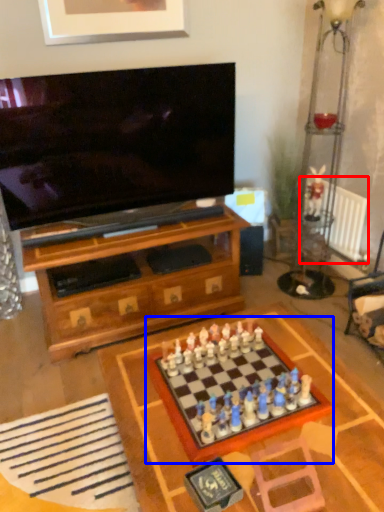
Question: Which point is further to the camera, radiator (highlighted by a red box) or board game (highlighted by a blue box)?

Choices:
 (A) radiator
 (B) board game

Answer: (A)